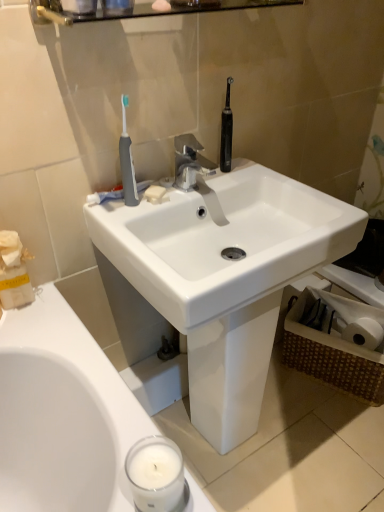
Where is `free spot to the right of white matte soap at sink center`? This screenshot has width=384, height=512. free spot to the right of white matte soap at sink center is located at coordinates (211, 181).